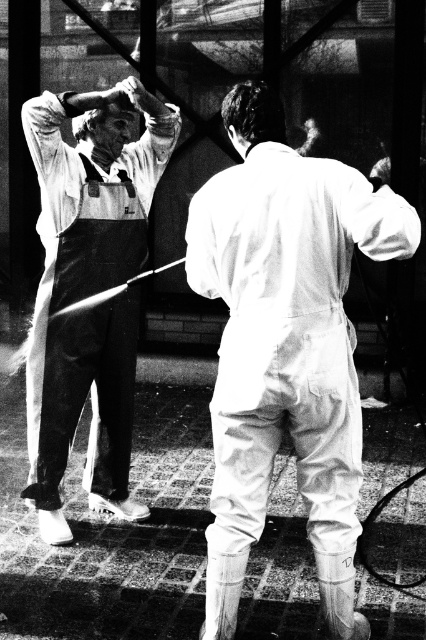
You are a photographer analyzing this black and white image. You notice the white matte jumpsuit at center and the matte white overalls at left. Based on their positions in the scene, which one is closer to the ground?

The white matte jumpsuit at center is below matte white overalls at left, so it is closer to the ground.

You are standing in the scene and want to reach the point marked at coordinates (241, 465). Considering the two people in the image, which one is closer to this point?

The point marked at coordinates (241, 465) is 11.76 feet away from the viewer. Since the question asks which person is closer to this point, the answer would depend on their positions relative to the point. However, the provided information only states the distance of the point from the viewer, not the distances of the individuals. Therefore, with the given data, it is impossible to determine which person is closer to the specified point.